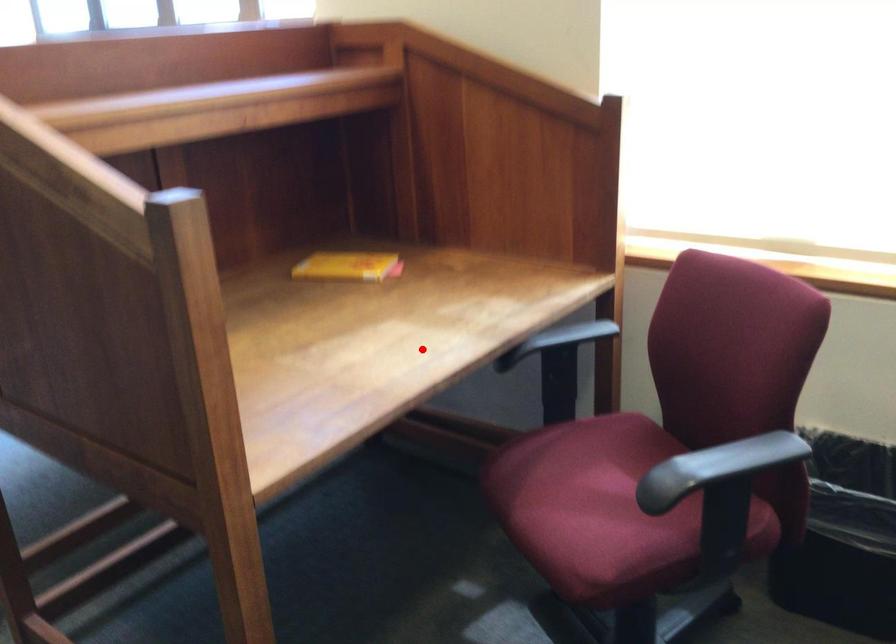
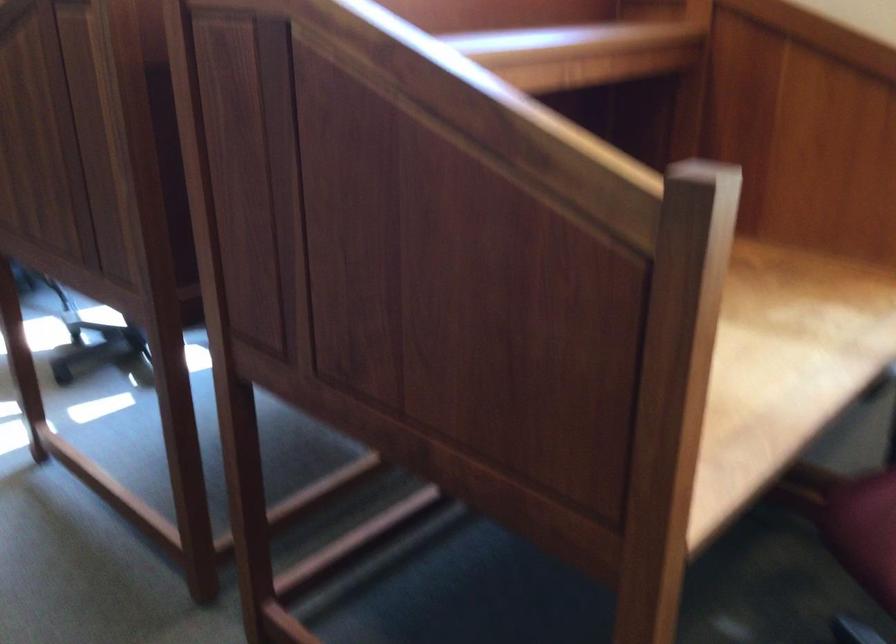
Question: I am providing you with two images of the same scene from different viewpoints. A red point is shown in image1. For the corresponding object point in image2, is it positioned nearer or farther from the camera?

Choices:
 (A) Nearer
 (B) Farther

Answer: (A)